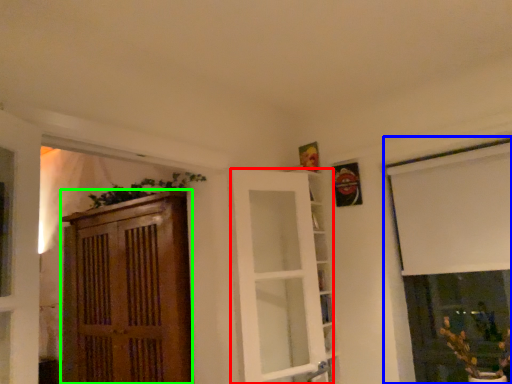
Question: Considering the real-world distances, which object is farthest from door (highlighted by a red box)? window (highlighted by a blue box) or cabinetry (highlighted by a green box)?

Choices:
 (A) window
 (B) cabinetry

Answer: (A)